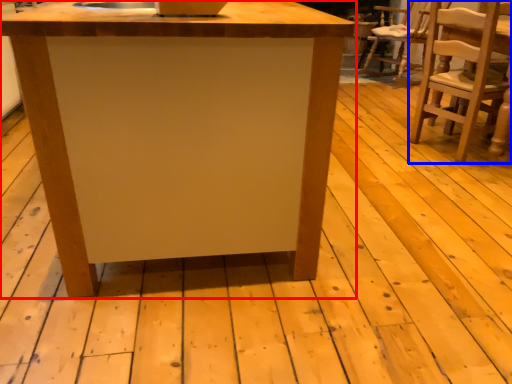
Question: Which object appears farthest to the camera in this image, table (highlighted by a red box) or chair (highlighted by a blue box)?

Choices:
 (A) table
 (B) chair

Answer: (B)